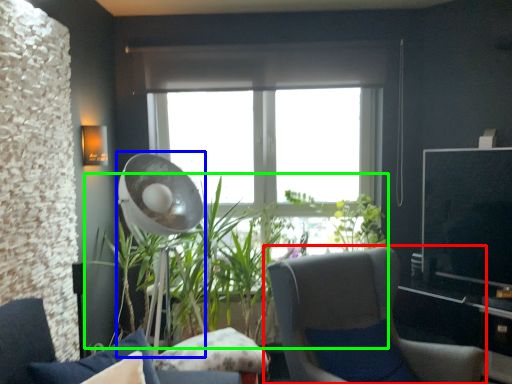
Question: Which is nearer to the chair (highlighted by a red box)? mechanical fan (highlighted by a blue box) or houseplant (highlighted by a green box).

Choices:
 (A) mechanical fan
 (B) houseplant

Answer: (B)